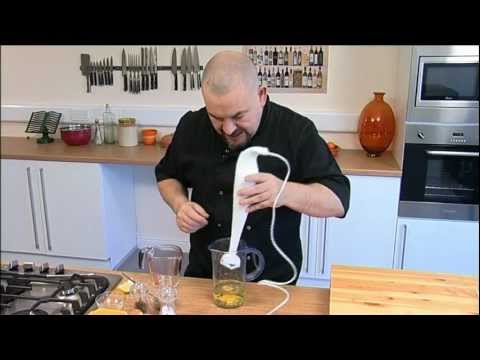
At what (x,y) coordinates should I click in order to perform the action: click on oven. Please return your answer as a coordinate pair (x, y). Looking at the image, I should click on (453, 80).